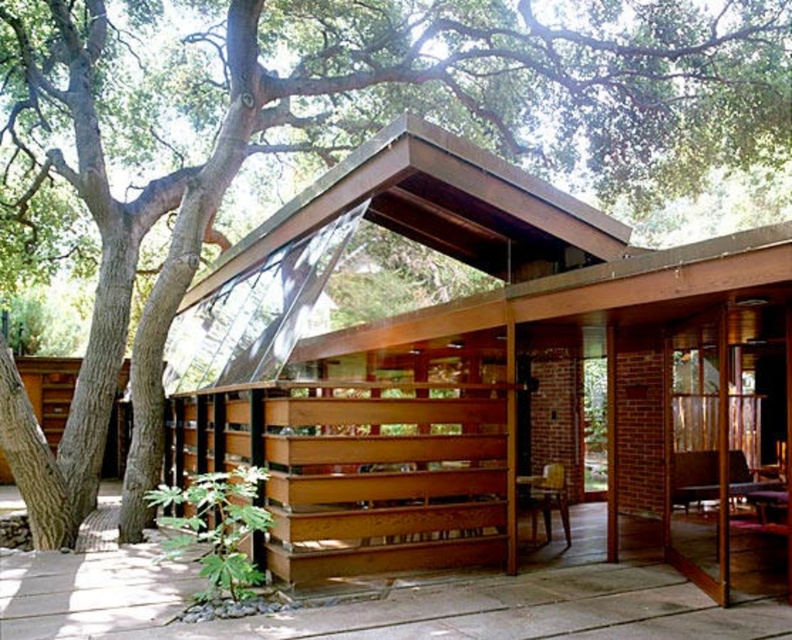
Does brown wooden deck at lower center lie in front of wooden chair at center?

Yes, it is in front of wooden chair at center.

Can you confirm if brown wooden deck at lower center is wider than wooden chair at center?

In fact, brown wooden deck at lower center might be narrower than wooden chair at center.

Does point (2, 595) come closer to viewer compared to point (550, 470)?

That is True.

Find the location of `brown wooden deck at lower center`. brown wooden deck at lower center is located at coordinates (383, 602).